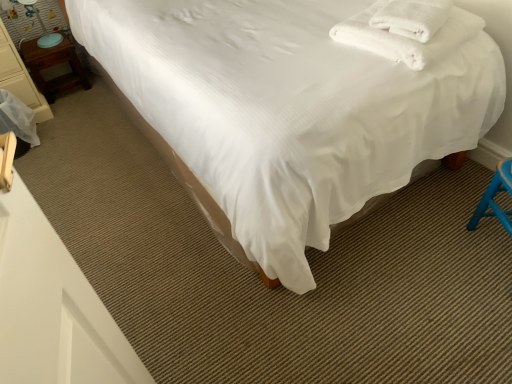
Locate an element on the screen. The height and width of the screenshot is (384, 512). vacant space situated above wooden nightstand at left (from a real-world perspective) is located at coordinates (49, 42).